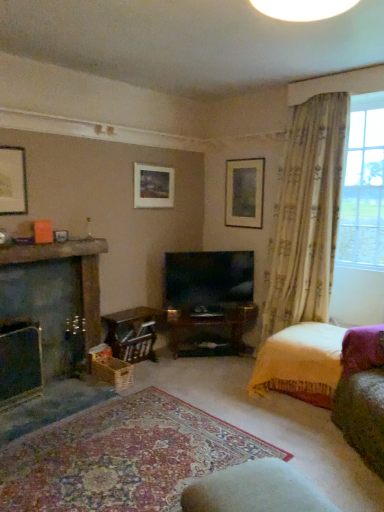
In order to click on vacant region under matte black fireplace at left, which is the 1th fireplace from front to back (from a real-world perspective) in this screenshot , I will do `click(28, 397)`.